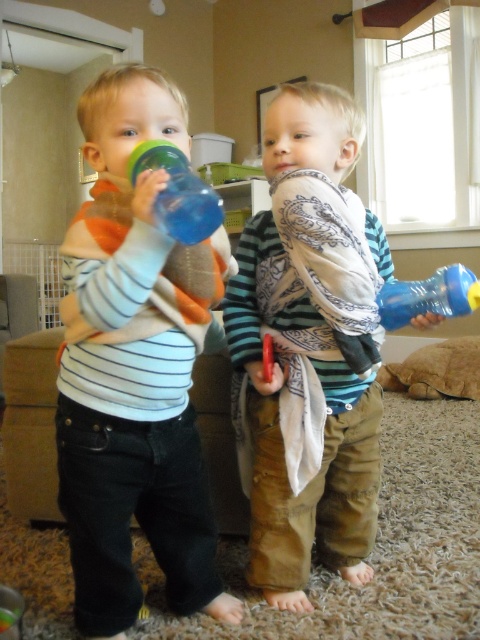
Between blue plastic bottle at center and blue plastic bottle at right, which one has more height?

With more height is blue plastic bottle at center.

This screenshot has width=480, height=640. What do you see at coordinates (178, 193) in the screenshot? I see `blue plastic bottle at center` at bounding box center [178, 193].

Identify the location of blue plastic bottle at center. (178, 193).

Between point (87, 99) and point (469, 269), which one is positioned behind?

Positioned behind is point (469, 269).

Can you confirm if matte plastic water bottle at left is thinner than blue plastic bottle at right?

No.

At what (x,y) coordinates should I click in order to perform the action: click on matte plastic water bottle at left. Please return your answer as a coordinate pair (x, y). Looking at the image, I should click on (134, 369).

The height and width of the screenshot is (640, 480). Identify the location of matte plastic water bottle at left. (134, 369).

In the scene shown: Does matte plastic water bottle at left appear under blue plastic bottle at center?

Indeed, matte plastic water bottle at left is positioned under blue plastic bottle at center.

Which is behind, point (63, 266) or point (187, 228)?

Positioned behind is point (63, 266).

Measure the distance between point [137,476] and camera.

Point [137,476] is 1.17 meters away from camera.

Locate an element on the screen. The height and width of the screenshot is (640, 480). matte plastic water bottle at left is located at coordinates (134, 369).